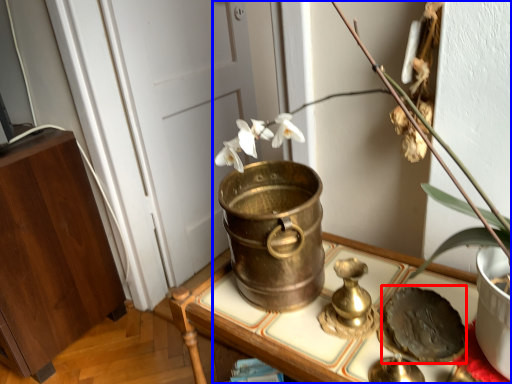
Question: Which object appears closest to the camera in this image, food (highlighted by a red box) or houseplant (highlighted by a blue box)?

Choices:
 (A) food
 (B) houseplant

Answer: (B)